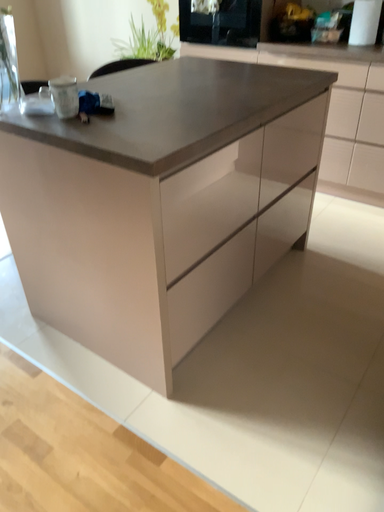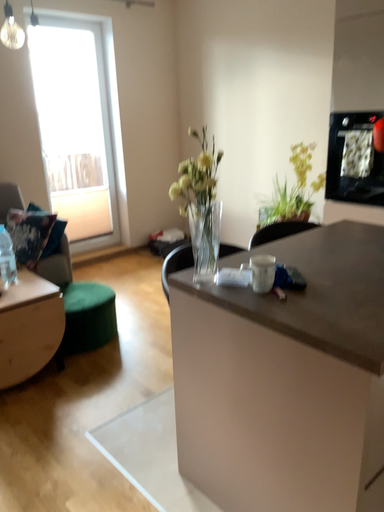
Question: Which way did the camera rotate in the video?

Choices:
 (A) rotated right
 (B) rotated left

Answer: (B)